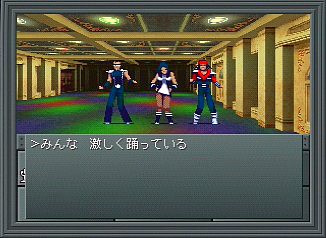
Where is `wall to the left of people`? wall to the left of people is located at coordinates (259, 83).